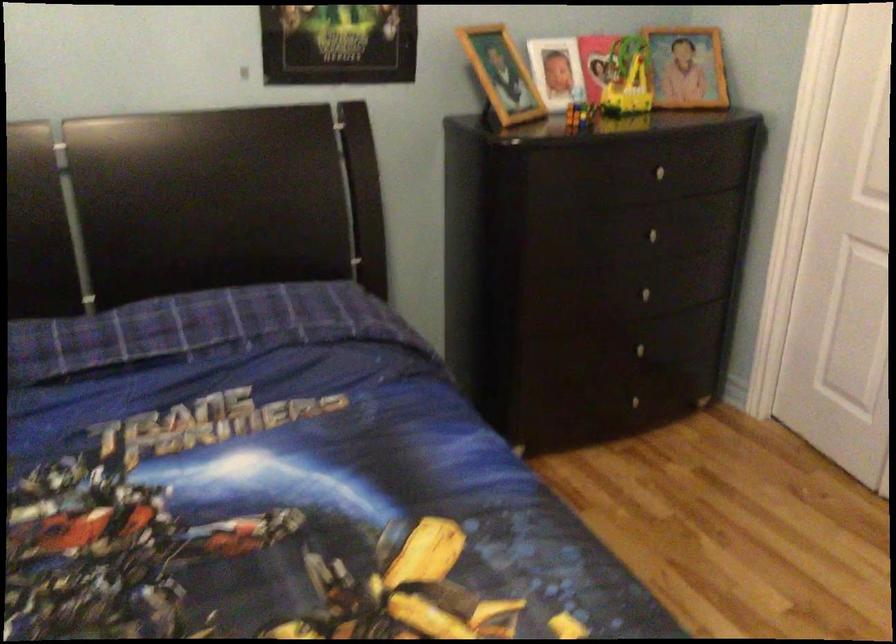
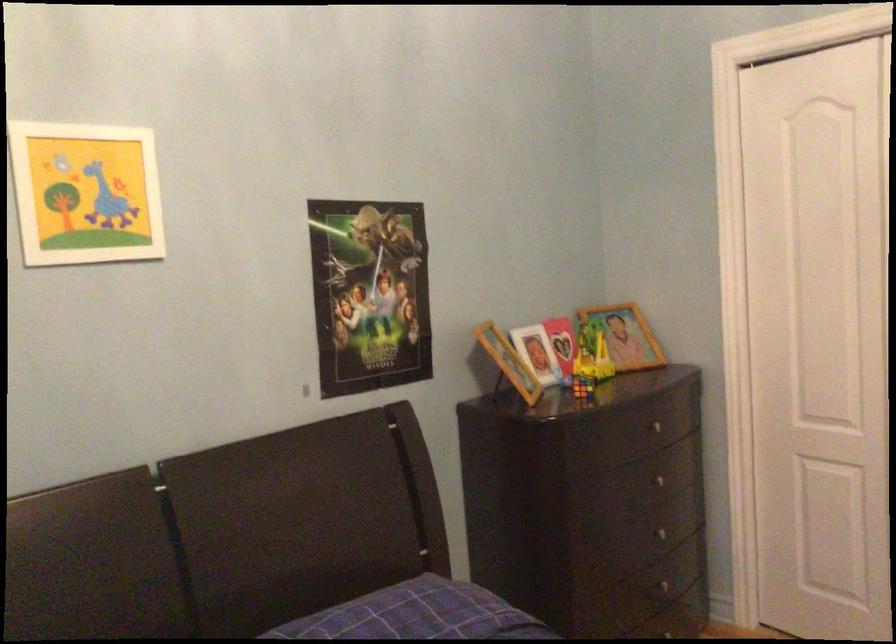
Locate, in the second image, the point that corresponds to (645,230) in the first image.

(656, 480)